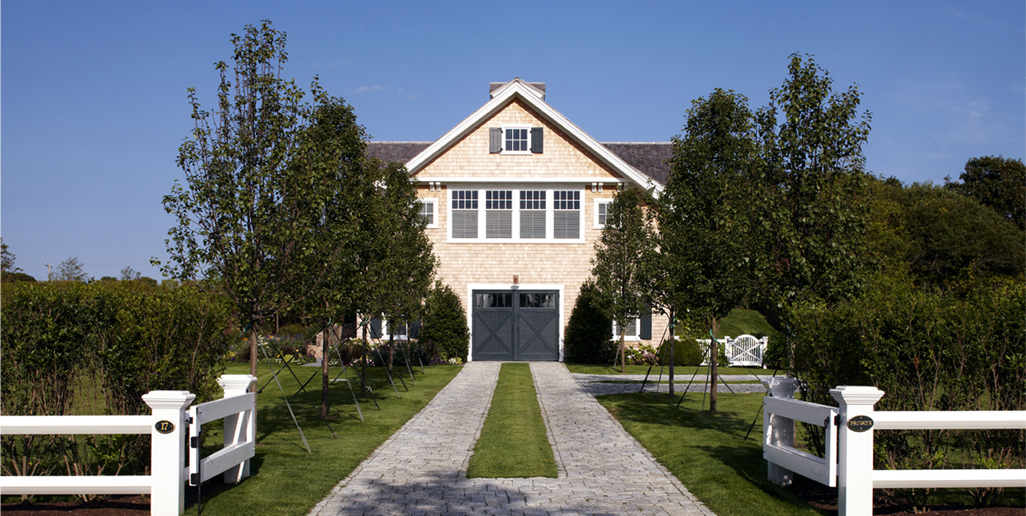
At what (x,y) coordinates should I click in order to perform the action: click on windows. Please return your answer as a coordinate pair (x, y). Looking at the image, I should click on (464, 204), (491, 202), (532, 192), (564, 202), (515, 137).